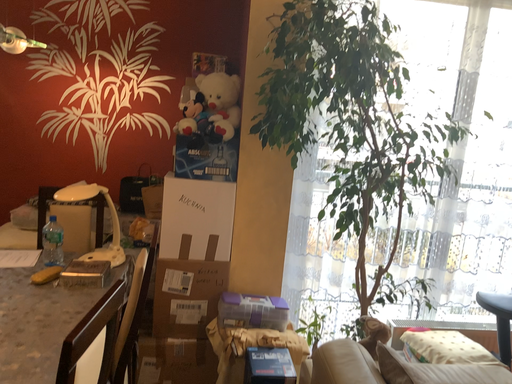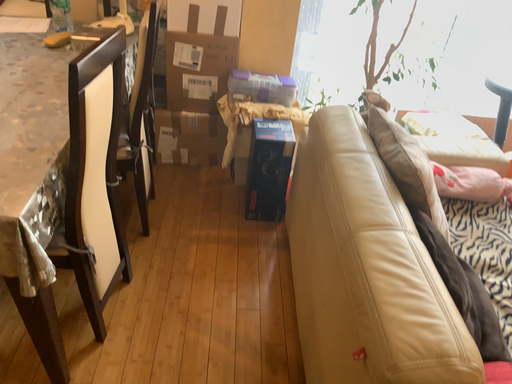
Question: How did the camera likely rotate when shooting the video?

Choices:
 (A) rotated downward
 (B) rotated upward

Answer: (A)